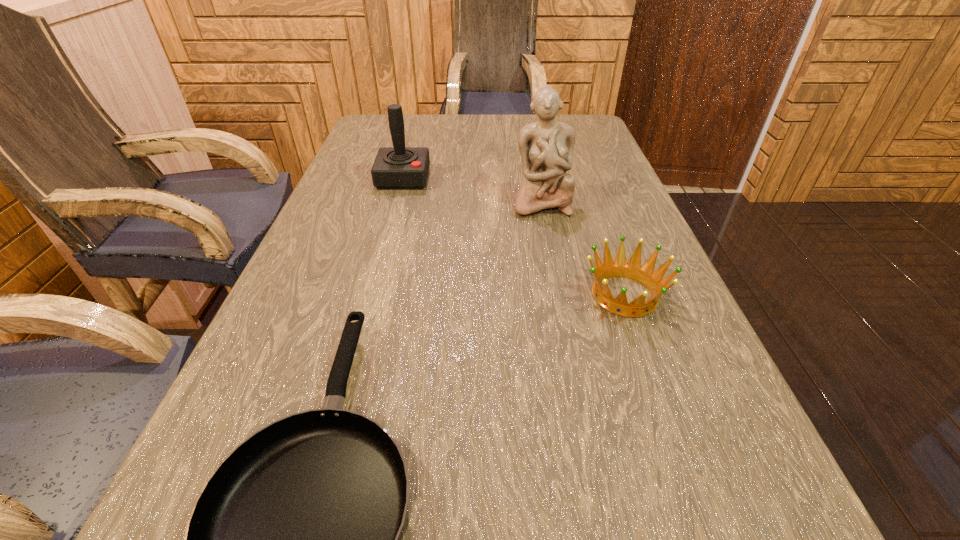
I want to click on figurine, so click(546, 147).

I want to click on joystick, so click(398, 167).

The width and height of the screenshot is (960, 540). I want to click on the third farthest object, so click(x=644, y=274).

This screenshot has height=540, width=960. In order to click on the third tallest object in this screenshot , I will do `click(644, 274)`.

Identify the location of free location located 0.080m on the front-facing side of the tallest object. (548, 239).

At what (x,y) coordinates should I click in order to perform the action: click on free space located on the base of the second tallest object. Please return your answer as a coordinate pair (x, y). The height and width of the screenshot is (540, 960). Looking at the image, I should click on (378, 269).

Locate an element on the screen. The height and width of the screenshot is (540, 960). vacant space located on the back of the third tallest object is located at coordinates (581, 174).

I want to click on object that is at the left edge, so click(x=398, y=167).

Image resolution: width=960 pixels, height=540 pixels. I want to click on figurine that is at the right edge, so click(546, 147).

Where is `crown present at the right edge`? crown present at the right edge is located at coordinates (644, 274).